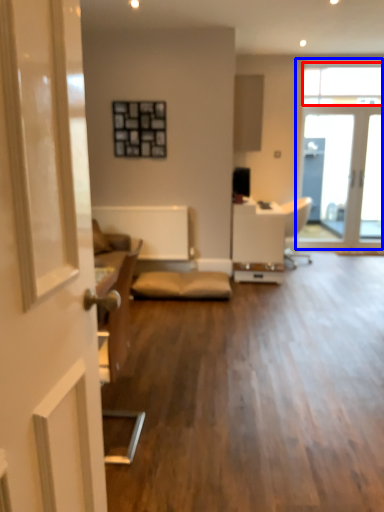
Question: Among these objects, which one is nearest to the camera, window (highlighted by a red box) or window (highlighted by a blue box)?

Choices:
 (A) window
 (B) window

Answer: (A)